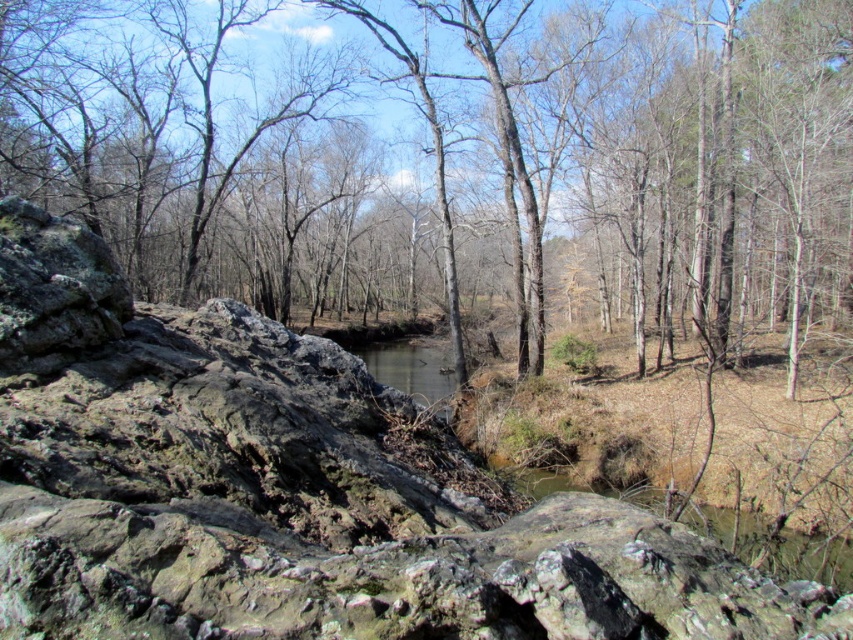
Is brown rough rock at left below rough textured rock at center?

Actually, brown rough rock at left is above rough textured rock at center.

Which of these two, brown rough rock at left or rough textured rock at center, stands shorter?

rough textured rock at center is shorter.

What do you see at coordinates (456, 160) in the screenshot? I see `brown rough rock at left` at bounding box center [456, 160].

The width and height of the screenshot is (853, 640). Identify the location of brown rough rock at left. (456, 160).